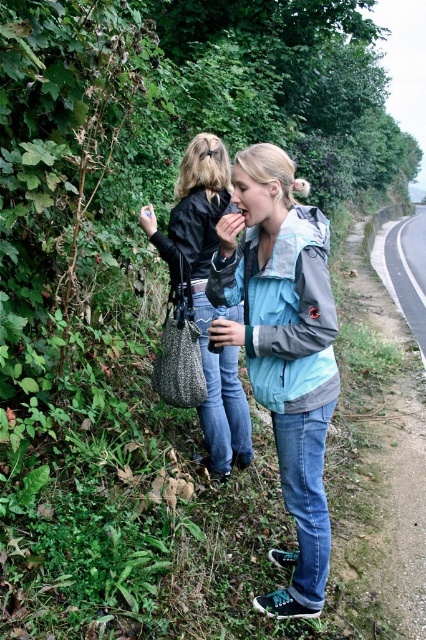
Can you confirm if light blue fabric jacket at center is positioned above leather jacket at center?

No, light blue fabric jacket at center is not above leather jacket at center.

Can you confirm if light blue fabric jacket at center is shorter than leather jacket at center?

No.

Is point (215, 291) positioned behind point (227, 376)?

That is False.

I want to click on light blue fabric jacket at center, so click(282, 348).